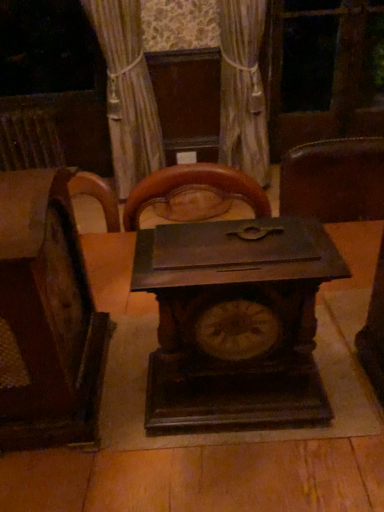
At what (x,y) coordinates should I click in order to perform the action: click on wooden chair at left. Please return your answer as a coordinate pair (x, y). Looking at the image, I should click on [46, 317].

In order to face wooden chair at left, should I rotate leftwards or rightwards?

Rotate your view left by about 21.841°.

What is the approximate height of dark wood table at center?

30.00 inches.

What are the coordinates of `transparent glass screen door at upper center` in the screenshot? It's located at (325, 71).

Find the location of a particular element. The width and height of the screenshot is (384, 512). silky beige curtain at upper center is located at coordinates (243, 89).

Where is `rusty metal radiator at left`? This screenshot has height=512, width=384. rusty metal radiator at left is located at coordinates (29, 139).

Describe the element at coordinates (235, 322) in the screenshot. I see `dark brown wood clock at center` at that location.

You are a GUI agent. You are given a task and a screenshot of the screen. Output one action in this format:
    pyautogui.click(x=<x>, y=<y>)
    Task: Click on the wooden chair at left
    
    Given the screenshot: What is the action you would take?
    pyautogui.click(x=46, y=317)

From a real-world perspective, is transparent glass screen door at upper center physically above wooden chair at left?

No.

This screenshot has height=512, width=384. Find the location of `screen door directly beneath the wooden chair at left (from a real-world perspective)`. screen door directly beneath the wooden chair at left (from a real-world perspective) is located at coordinates (325, 71).

Considering the sizes of objects transparent glass screen door at upper center and wooden chair at left in the image provided, who is shorter, transparent glass screen door at upper center or wooden chair at left?

Standing shorter between the two is wooden chair at left.

What's the angular difference between transparent glass screen door at upper center and wooden chair at left's facing directions?

The facing directions of transparent glass screen door at upper center and wooden chair at left are 3.28 degrees apart.

Who is taller, transparent glass screen door at upper center or dark brown wood clock at center?

Standing taller between the two is transparent glass screen door at upper center.

How different are the orientations of transparent glass screen door at upper center and dark brown wood clock at center in degrees?

1.51 degrees.

From the image's perspective, who appears lower, transparent glass screen door at upper center or dark brown wood clock at center?

dark brown wood clock at center.

Is transparent glass screen door at upper center closer to camera compared to dark brown wood clock at center?

No.

What's the angular difference between silky beige curtain at upper center and wooden chair at left's facing directions?

They differ by 0.662 degrees in their facing directions.

Is silky beige curtain at upper center inside the boundaries of wooden chair at left, or outside?

silky beige curtain at upper center is spatially situated outside wooden chair at left.

In terms of size, does silky beige curtain at upper center appear bigger or smaller than wooden chair at left?

silky beige curtain at upper center is bigger than wooden chair at left.

From a real-world perspective, is rusty metal radiator at left under transparent glass screen door at upper center?

Yes, from a real-world perspective, rusty metal radiator at left is under transparent glass screen door at upper center.

What's the angular difference between rusty metal radiator at left and transparent glass screen door at upper center's facing directions?

0.112 degrees.

Find the location of a particular element. Image resolution: width=384 pixels, height=512 pixels. screen door above the rusty metal radiator at left (from a real-world perspective) is located at coordinates (325, 71).

Is there a large distance between rusty metal radiator at left and transparent glass screen door at upper center?

Yes, rusty metal radiator at left and transparent glass screen door at upper center are located far from each other.

Choose the correct answer: Is dark brown wood clock at center inside rusty metal radiator at left or outside it?

dark brown wood clock at center exists outside the volume of rusty metal radiator at left.

Which is behind, dark brown wood clock at center or rusty metal radiator at left?

rusty metal radiator at left is more distant.

Could you tell me if dark brown wood clock at center is turned towards rusty metal radiator at left?

No, dark brown wood clock at center is not turned towards rusty metal radiator at left.

How different are the orientations of dark brown wood clock at center and rusty metal radiator at left in degrees?

1.4 degrees.

Is wooden chair at left with dark wood table at center?

No, wooden chair at left is not in contact with dark wood table at center.

Does wooden chair at left appear on the right side of dark wood table at center?

No.

From a real-world perspective, is wooden chair at left positioned over dark wood table at center based on gravity?

Yes, from a real-world perspective, wooden chair at left is above dark wood table at center.

How different are the orientations of wooden chair at left and dark wood table at center in degrees?

94.3 degrees separate the facing orientations of wooden chair at left and dark wood table at center.

Can wooden chair at left be found inside dark wood table at center?

Actually, wooden chair at left is outside dark wood table at center.

From a real-world perspective, is dark wood table at center positioned over wooden chair at left based on gravity?

No, from a real-world perspective, dark wood table at center is not on top of wooden chair at left.

Which of these two, dark wood table at center or wooden chair at left, is smaller?

wooden chair at left is smaller.

From the image's perspective, would you say dark wood table at center is positioned over wooden chair at left?

No, from the image's perspective, dark wood table at center is not over wooden chair at left.

You are a GUI agent. You are given a task and a screenshot of the screen. Output one action in this format:
    pyautogui.click(x=<x>, y=<y>)
    Task: Click on the screen door behind the wooden chair at left
    This screenshot has height=512, width=384.
    Given the screenshot: What is the action you would take?
    pyautogui.click(x=325, y=71)

At what (x,y) coordinates should I click in order to perform the action: click on clock located in front of the transparent glass screen door at upper center. Please return your answer as a coordinate pair (x, y). This screenshot has height=512, width=384. Looking at the image, I should click on (235, 322).

When comparing their distances from dark wood table at center, does transparent glass screen door at upper center or silky beige curtain at upper center seem further?

Based on the image, transparent glass screen door at upper center appears to be further to dark wood table at center.

Looking at this image, when comparing their distances from silky beige curtain at upper center, does dark brown wood clock at center or wooden chair at left seem closer?

wooden chair at left.

From the image, which object appears to be farther from wooden chair at left, transparent glass screen door at upper center or silky beige curtain at upper center?

Based on the image, transparent glass screen door at upper center appears to be further to wooden chair at left.

Based on the photo, which object lies further to the anchor point wooden chair at left, silky beige curtain at upper center or transparent glass screen door at upper center?

transparent glass screen door at upper center is positioned further to the anchor wooden chair at left.

When comparing their distances from dark brown wood clock at center, does wooden chair at left or silky beige curtain at upper center seem further?

silky beige curtain at upper center lies further to dark brown wood clock at center than the other object.

Estimate the real-world distances between objects in this image. Which object is further from silky beige curtain at upper center, wooden chair at left or rusty metal radiator at left?

wooden chair at left is positioned further to the anchor silky beige curtain at upper center.

Which object lies further to the anchor point wooden chair at left, transparent glass screen door at upper center or rusty metal radiator at left?

Based on the image, transparent glass screen door at upper center appears to be further to wooden chair at left.

Estimate the real-world distances between objects in this image. Which object is closer to wooden chair at left, rusty metal radiator at left or transparent glass screen door at upper center?

Among the two, rusty metal radiator at left is located nearer to wooden chair at left.

I want to click on curtain between dark wood table at center and transparent glass screen door at upper center in the front-back direction, so click(243, 89).

Find the location of `table between wooden chair at left and transparent glass screen door at upper center from front to back`. table between wooden chair at left and transparent glass screen door at upper center from front to back is located at coordinates (199, 479).

At what (x,y) coordinates should I click in order to perform the action: click on table between dark brown wood clock at center and rusty metal radiator at left from front to back. Please return your answer as a coordinate pair (x, y). The image size is (384, 512). Looking at the image, I should click on (199, 479).

Find the location of a particular element. The width and height of the screenshot is (384, 512). screen door positioned between dark wood table at center and rusty metal radiator at left from near to far is located at coordinates (325, 71).